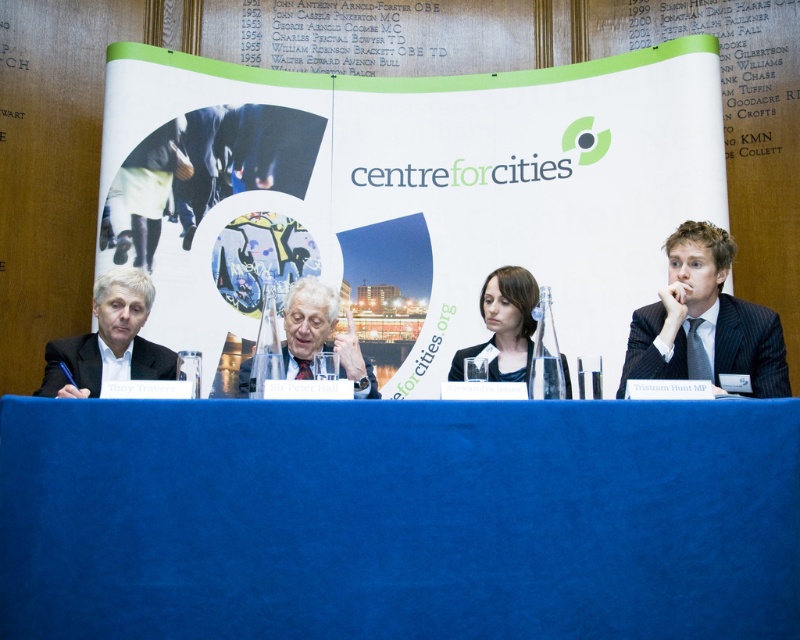
You are a photographer at a professional event. You want to take a photo of the matte black suit at center and the matte black hair at center such that both are visible in the frame. Given that your camera has a minimum focus distance of 1.5 meters, will you be able to capture both subjects clearly?

The matte black suit at center and matte black hair at center are 1.57 meters apart. Since the distance between them is greater than the camera minimum focus distance of 1.5 meters, the photographer can capture both subjects clearly in the frame.

You are a photographer at a conference event. You need to capture a candid shot of the matte black hair at center without including the white paper at center in the frame. Based on their positions, is this possible?

The white paper at center is to the right of the matte black hair at center, so if you position your camera to the left side of the matte black hair at center, you can capture the shot without including the white paper at center.